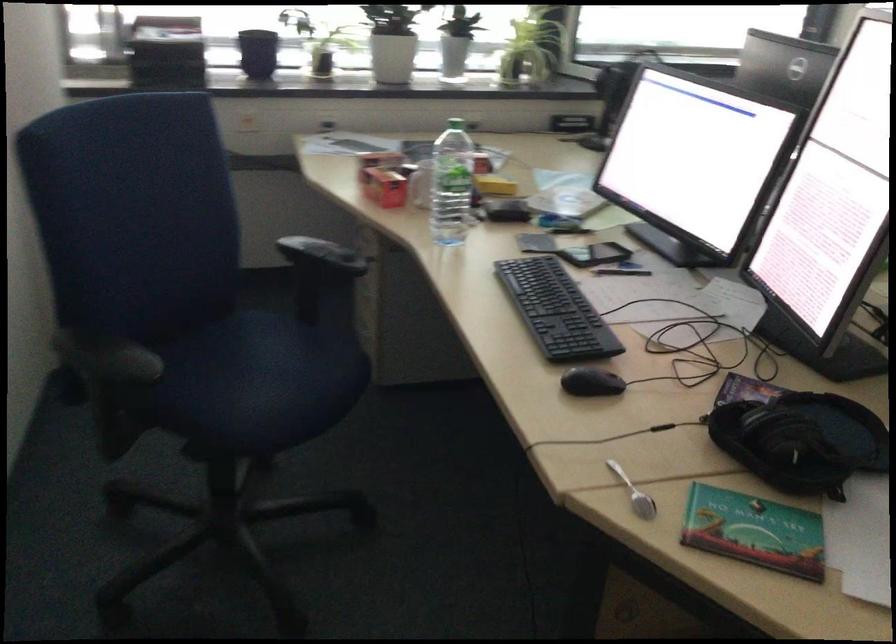
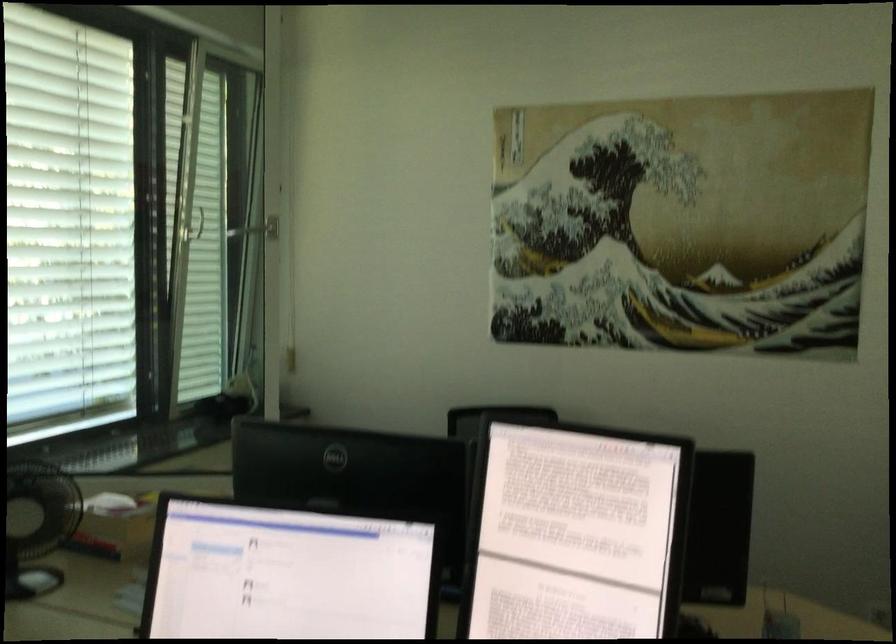
Question: The camera is either moving clockwise (left) or counter-clockwise (right) around the object. The first image is from the beginning of the video and the second image is from the end. Is the camera moving left or right when shooting the video?

Choices:
 (A) Left
 (B) Right

Answer: (A)